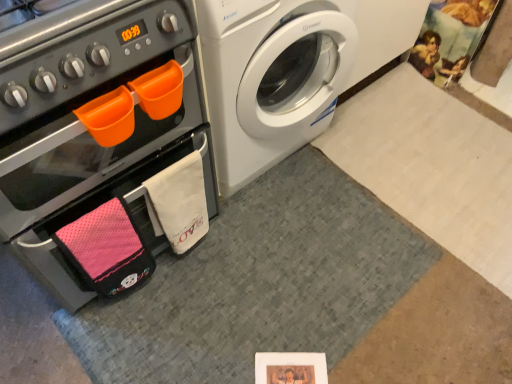
In order to face white glossy washing machine at upper right, should I rotate leftwards or rightwards?

Turn left by 3.161 degrees to look at white glossy washing machine at upper right.

Describe the element at coordinates (270, 78) in the screenshot. I see `white glossy washing machine at upper right` at that location.

At what (x,y) coordinates should I click in order to perform the action: click on white glossy washing machine at upper right. Please return your answer as a coordinate pair (x, y). This screenshot has width=512, height=384. Looking at the image, I should click on (270, 78).

Measure the distance between white glossy washing machine at upper right and camera.

A distance of 38.16 inches exists between white glossy washing machine at upper right and camera.

The height and width of the screenshot is (384, 512). I want to click on matte black oven at left, so click(x=88, y=132).

What do you see at coordinates (88, 132) in the screenshot? Image resolution: width=512 pixels, height=384 pixels. I see `matte black oven at left` at bounding box center [88, 132].

The height and width of the screenshot is (384, 512). I want to click on white glossy washing machine at upper right, so click(x=270, y=78).

Does white glossy washing machine at upper right appear on the left side of matte black oven at left?

In fact, white glossy washing machine at upper right is to the right of matte black oven at left.

In the image, is white glossy washing machine at upper right positioned in front of or behind matte black oven at left?

Visually, white glossy washing machine at upper right is located behind matte black oven at left.

Does point (296, 25) come farther from viewer compared to point (135, 151)?

Yes, point (296, 25) is farther from viewer.

From the image's perspective, does white glossy washing machine at upper right appear lower than matte black oven at left?

No, from the image's perspective, white glossy washing machine at upper right is not beneath matte black oven at left.

From a real-world perspective, is white glossy washing machine at upper right positioned over matte black oven at left based on gravity?

No, from a real-world perspective, white glossy washing machine at upper right is not above matte black oven at left.

Is white glossy washing machine at upper right thinner than matte black oven at left?

Incorrect, the width of white glossy washing machine at upper right is not less than that of matte black oven at left.

Is white glossy washing machine at upper right shorter than matte black oven at left?

Correct, white glossy washing machine at upper right is not as tall as matte black oven at left.

Between white glossy washing machine at upper right and matte black oven at left, which one has smaller size?

white glossy washing machine at upper right.

Can matte black oven at left be found inside white glossy washing machine at upper right?

No, matte black oven at left is located outside of white glossy washing machine at upper right.

Would you say white glossy washing machine at upper right is a long distance from matte black oven at left?

No, white glossy washing machine at upper right is not far from matte black oven at left.

Is matte black oven at left at the back of white glossy washing machine at upper right?

No, matte black oven at left is not at the back of white glossy washing machine at upper right.

Based on the photo, can you tell me how much white glossy washing machine at upper right and matte black oven at left differ in facing direction?

1.12 degrees separate the facing orientations of white glossy washing machine at upper right and matte black oven at left.

Locate an element on the screen. This screenshot has height=384, width=512. oven above the white glossy washing machine at upper right (from a real-world perspective) is located at coordinates (88, 132).

Which is more to the left, matte black oven at left or white glossy washing machine at upper right?

matte black oven at left.

Which object is more forward, matte black oven at left or white glossy washing machine at upper right?

matte black oven at left.

Between point (39, 188) and point (210, 7), which one is positioned behind?

The point (39, 188) is farther from the camera.

From the image's perspective, which one is positioned lower, matte black oven at left or white glossy washing machine at upper right?

matte black oven at left appears lower in the image.

From a real-world perspective, is matte black oven at left positioned under white glossy washing machine at upper right based on gravity?

No, from a real-world perspective, matte black oven at left is not beneath white glossy washing machine at upper right.

Is matte black oven at left wider or thinner than white glossy washing machine at upper right?

matte black oven at left is thinner than white glossy washing machine at upper right.

Considering the sizes of objects matte black oven at left and white glossy washing machine at upper right in the image provided, who is taller, matte black oven at left or white glossy washing machine at upper right?

With more height is matte black oven at left.

Which of these two, matte black oven at left or white glossy washing machine at upper right, is smaller?

With smaller size is white glossy washing machine at upper right.

Is matte black oven at left not within white glossy washing machine at upper right?

matte black oven at left is positioned outside white glossy washing machine at upper right.

Is there a large distance between matte black oven at left and white glossy washing machine at upper right?

That's not correct — matte black oven at left is a little close to white glossy washing machine at upper right.

Is matte black oven at left oriented away from white glossy washing machine at upper right?

That's not correct — matte black oven at left is not looking away from white glossy washing machine at upper right.

How distant is matte black oven at left from white glossy washing machine at upper right?

matte black oven at left is 13.50 inches from white glossy washing machine at upper right.

Locate an element on the screen. washing machine on the right of matte black oven at left is located at coordinates (270, 78).

Where is `washing machine above the matte black oven at left (from the image's perspective)`? Image resolution: width=512 pixels, height=384 pixels. washing machine above the matte black oven at left (from the image's perspective) is located at coordinates (270, 78).

The height and width of the screenshot is (384, 512). Identify the location of washing machine on the right of matte black oven at left. (270, 78).